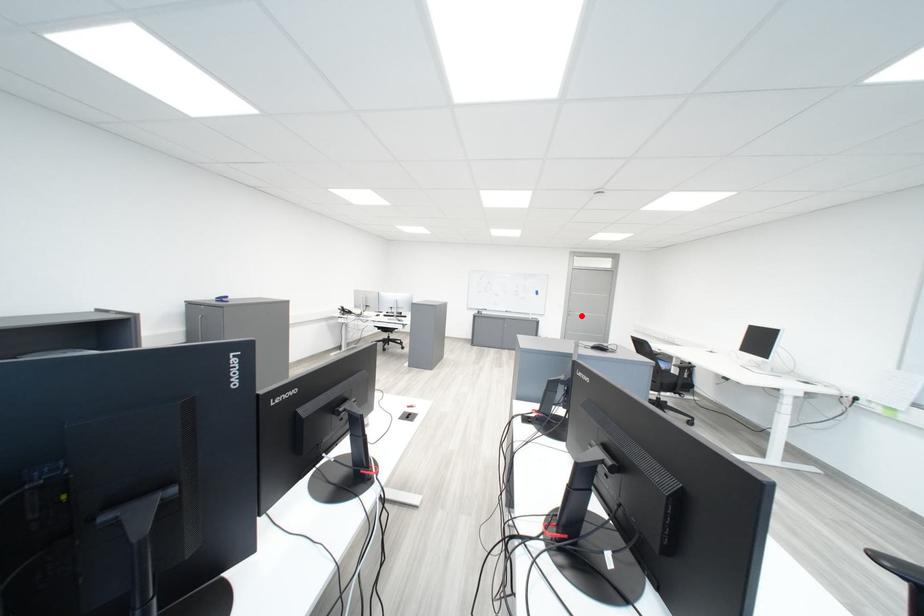
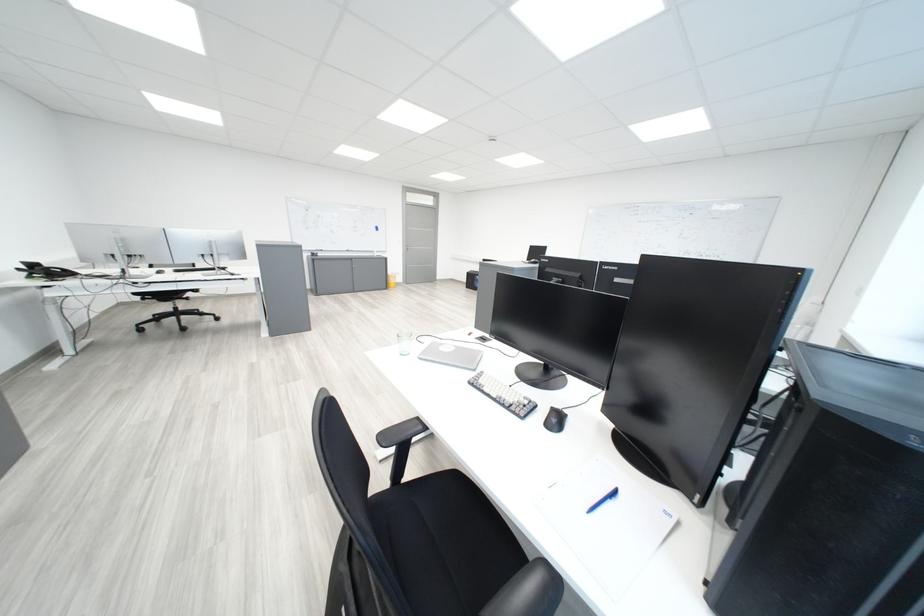
Find the pixel in the second image that matches the highlighted location in the first image.

(419, 251)